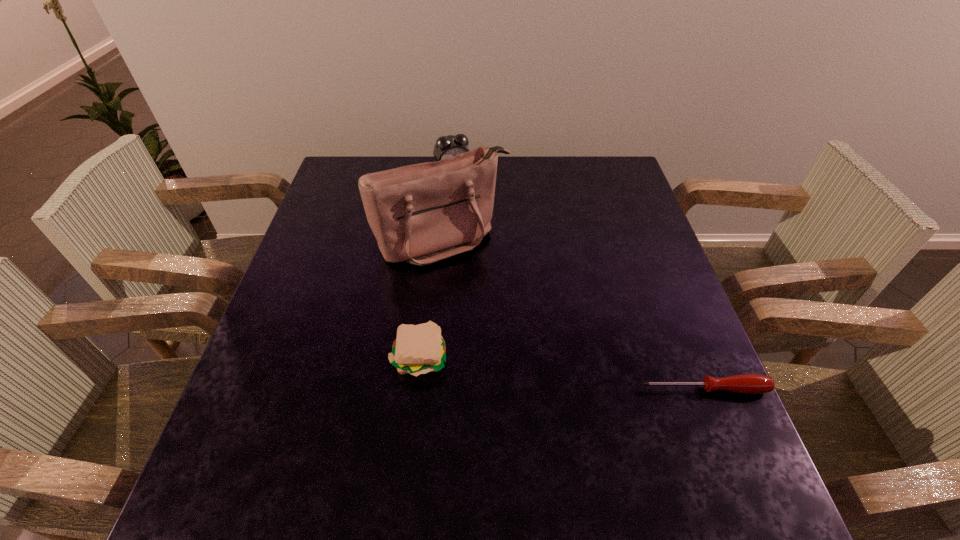
The height and width of the screenshot is (540, 960). Find the location of `free point between the second farthest object and the screwdriver`. free point between the second farthest object and the screwdriver is located at coordinates (573, 315).

I want to click on vacant area between the shortest object and the shoulder bag, so click(573, 315).

Identify the location of object that stands as the third closest to the patty. (448, 146).

Where is `the second closest object to the third nearest object`? The image size is (960, 540). the second closest object to the third nearest object is located at coordinates (418, 349).

Locate an element on the screen. The height and width of the screenshot is (540, 960). blank space that satisfies the following two spatial constraints: 1. on the back side of the second tallest object; 2. on the left side of the third tallest object is located at coordinates (441, 173).